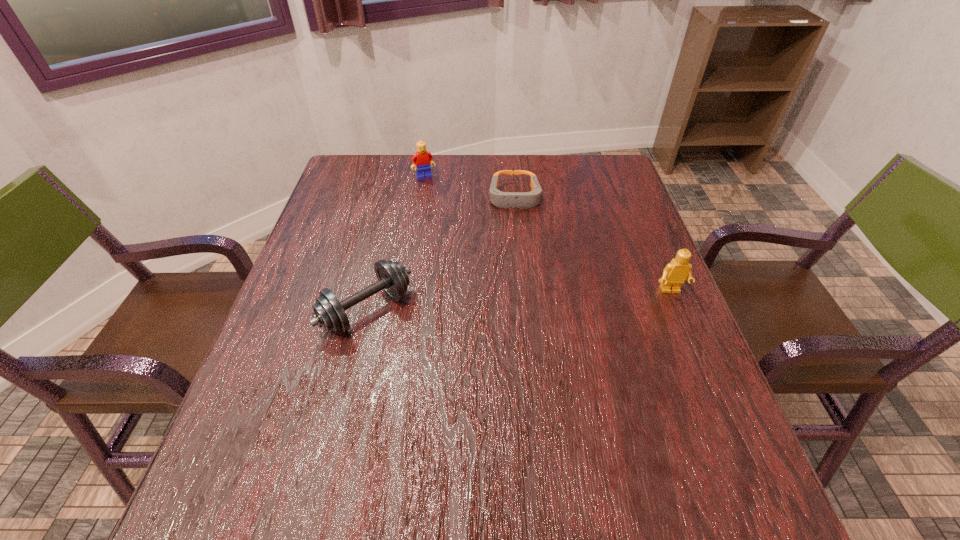
At what (x,y) coordinates should I click in order to perform the action: click on vacant space that is in between the second object from right to left and the rightmost object. Please return your answer as a coordinate pair (x, y). This screenshot has height=540, width=960. Looking at the image, I should click on coord(592,244).

Where is `free space between the farther Lego and the right Lego`? This screenshot has height=540, width=960. free space between the farther Lego and the right Lego is located at coordinates (547, 234).

You are a GUI agent. You are given a task and a screenshot of the screen. Output one action in this format:
    pyautogui.click(x=<x>, y=<y>)
    Task: Click on the empty space that is in between the third nearest object and the third tallest object
    
    Given the screenshot: What is the action you would take?
    pyautogui.click(x=441, y=253)

I want to click on vacant space that's between the second farthest object and the rightmost object, so click(592, 244).

The height and width of the screenshot is (540, 960). Identify the location of empty space that is in between the farther Lego and the dumbbell. (396, 244).

Locate an element on the screen. the third closest object to the right Lego is located at coordinates (422, 158).

Select which object is the second closest to the shortest object. Please provide its 2D coordinates. Your answer should be formatted as a tuple, i.e. [(x, y)], where the tuple contains the x and y coordinates of a point satisfying the conditions above.

[(329, 313)]